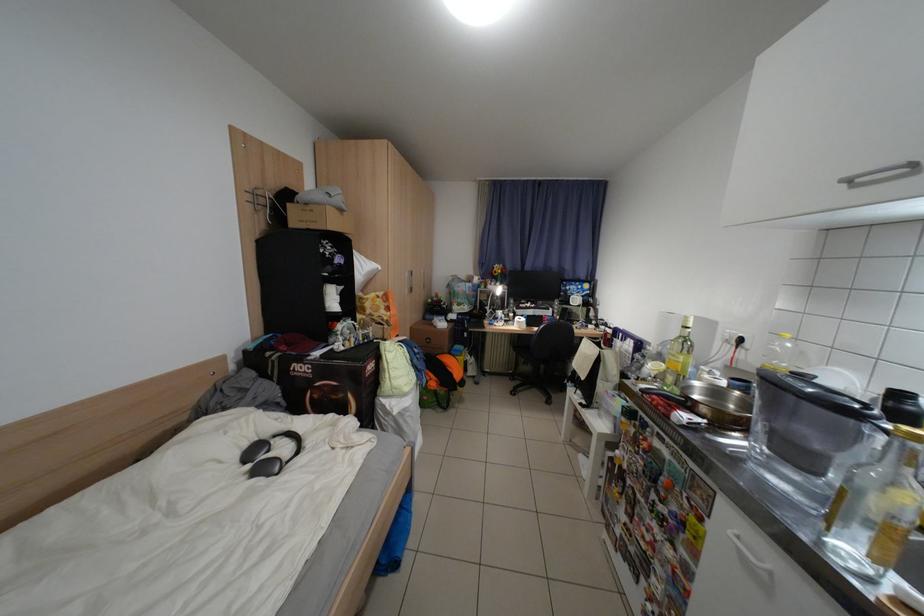
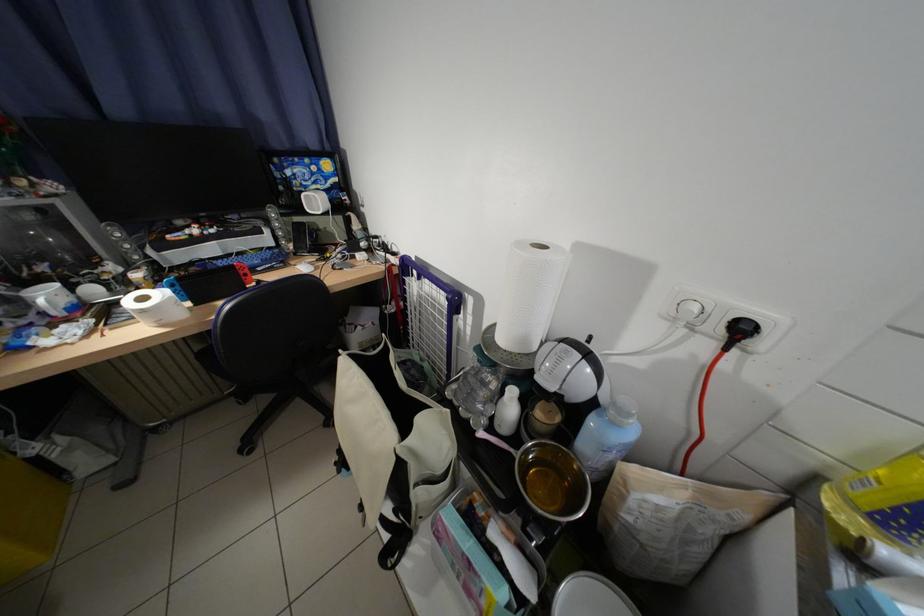
Where in the second image is the point corresponding to (759,346) from the first image?

(772, 345)